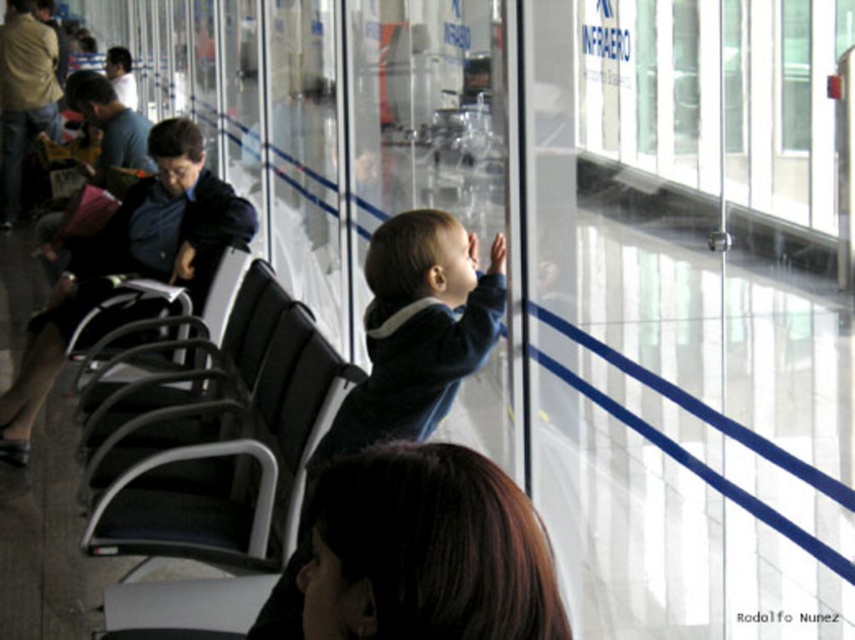
Question: Among these points, which one is nearest to the camera?

Choices:
 (A) (152, 522)
 (B) (429, 284)

Answer: (B)

Question: Which object is farther from the camera taking this photo?

Choices:
 (A) dark blue sweater at center
 (B) black fabric chair at center

Answer: (B)

Question: Is black fabric chair at center thinner than dark blue sweater at center?

Choices:
 (A) yes
 (B) no

Answer: (B)

Question: Is black fabric chair at center above dark blue sweater at center?

Choices:
 (A) yes
 (B) no

Answer: (B)

Question: Can you confirm if black fabric chair at center is positioned below dark blue sweater at center?

Choices:
 (A) yes
 (B) no

Answer: (A)

Question: Which point appears farthest from the camera in this image?

Choices:
 (A) (335, 380)
 (B) (449, 320)

Answer: (A)